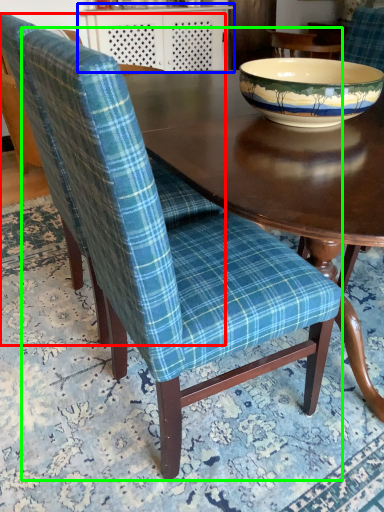
Question: Considering the real-world distances, which object is farthest from chair (highlighted by a red box)? table (highlighted by a blue box) or chair (highlighted by a green box)?

Choices:
 (A) table
 (B) chair

Answer: (A)